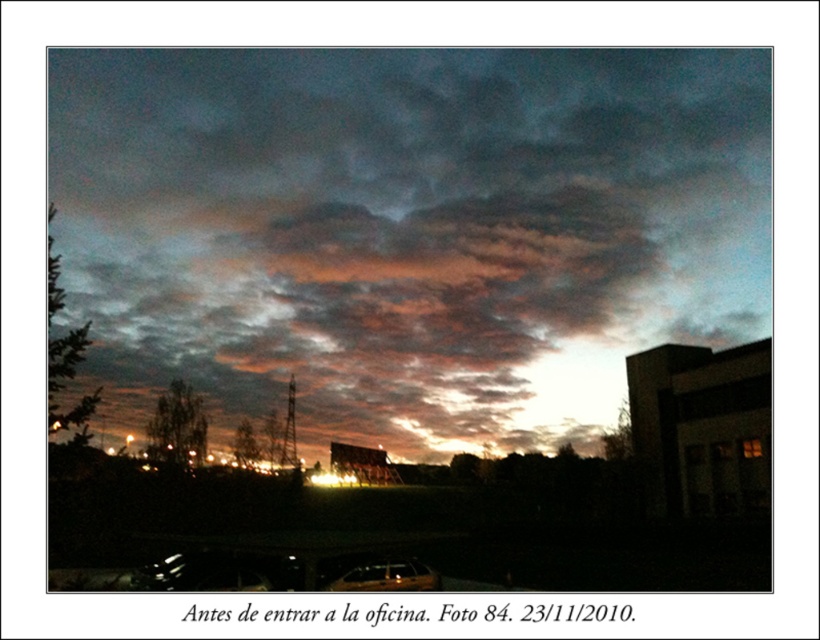
Question: Does metallic silver car at lower center have a greater width compared to transparent glass car window at lower center?

Choices:
 (A) yes
 (B) no

Answer: (A)

Question: Does metallic silver car at lower center have a lesser width compared to transparent glass car window at lower center?

Choices:
 (A) no
 (B) yes

Answer: (A)

Question: Which point is farther to the camera?

Choices:
 (A) cloudy sky at upper center
 (B) metallic gold car at lower center
 (C) metallic silver car at lower center
 (D) transparent glass car window at lower center

Answer: (A)

Question: Estimate the real-world distances between objects in this image. Which object is farther from the cloudy sky at upper center?

Choices:
 (A) transparent glass car window at lower center
 (B) metallic gold car at lower center

Answer: (B)

Question: Which of the following is the closest to the observer?

Choices:
 (A) (362, 317)
 (B) (367, 589)

Answer: (B)

Question: Does metallic silver car at lower center appear on the left side of transparent glass car window at lower center?

Choices:
 (A) yes
 (B) no

Answer: (A)